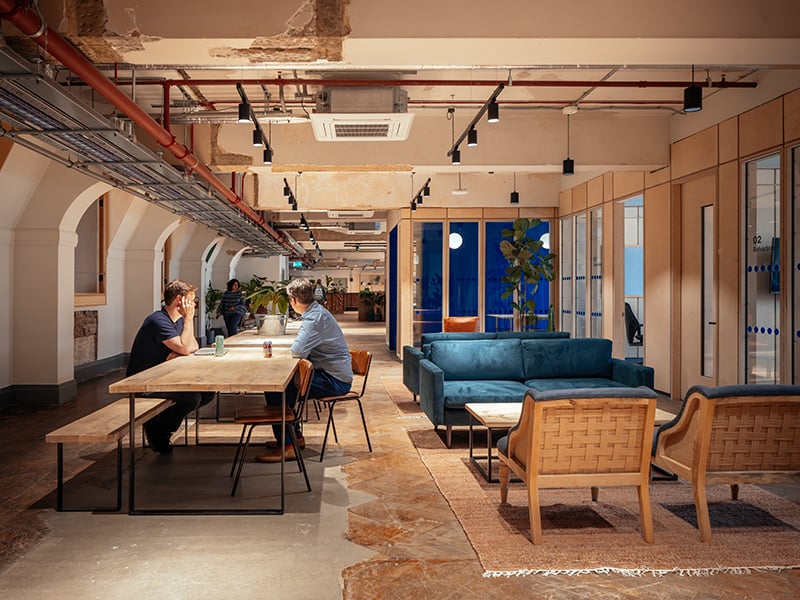
The image size is (800, 600). In order to click on chairs in this screenshot , I will do `click(602, 429)`, `click(742, 436)`, `click(464, 323)`, `click(366, 363)`, `click(302, 388)`, `click(633, 320)`.